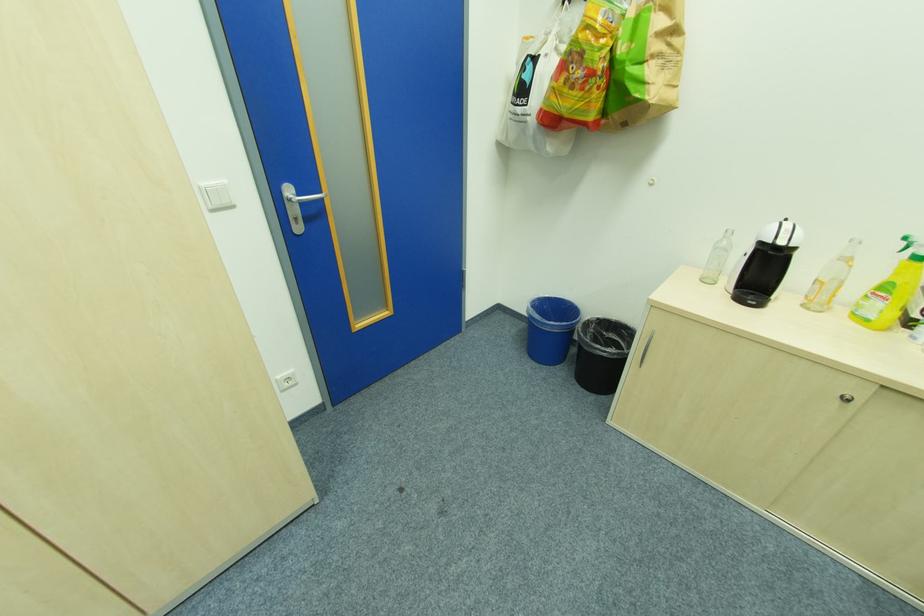
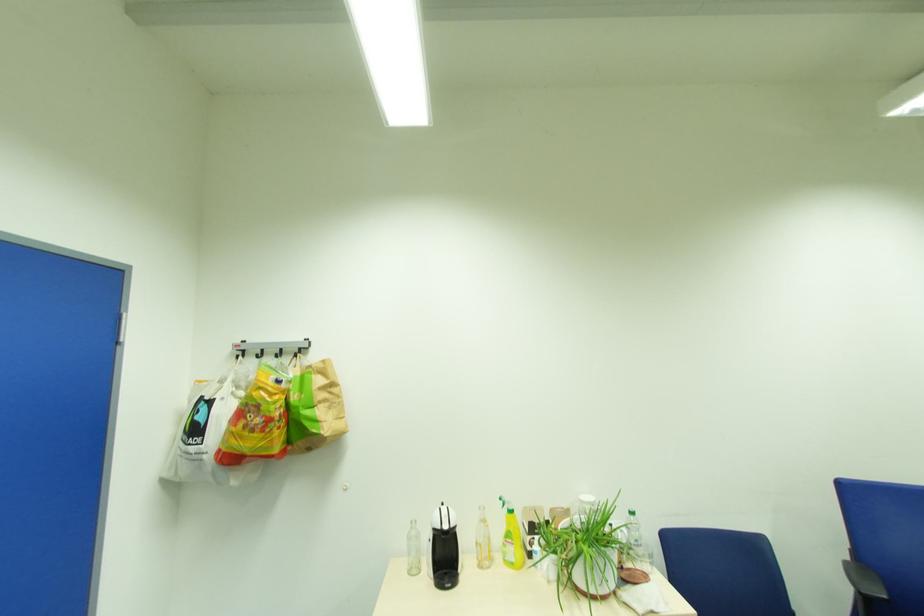
The first image is from the beginning of the video and the second image is from the end. How did the camera likely rotate when shooting the video?

The rotation direction of the camera is right-up.